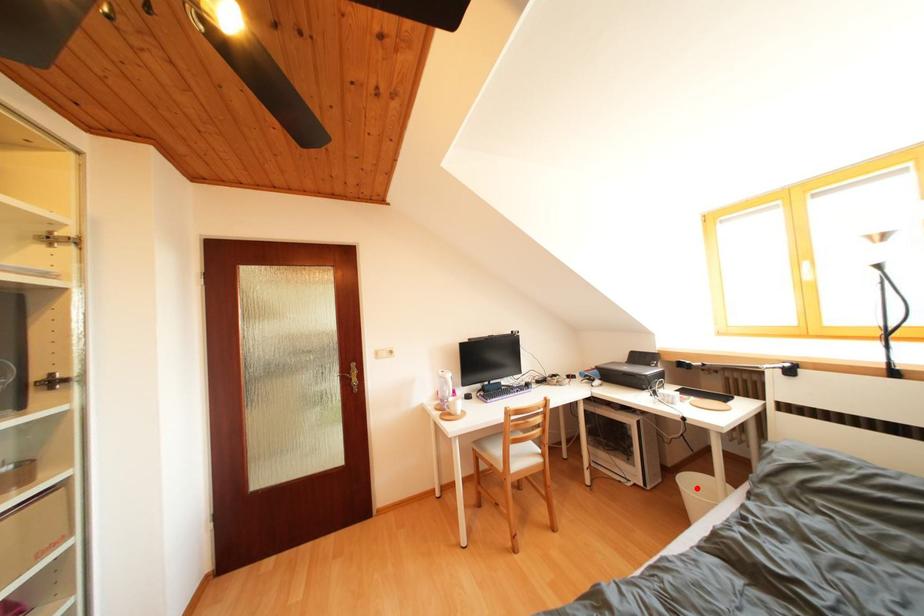
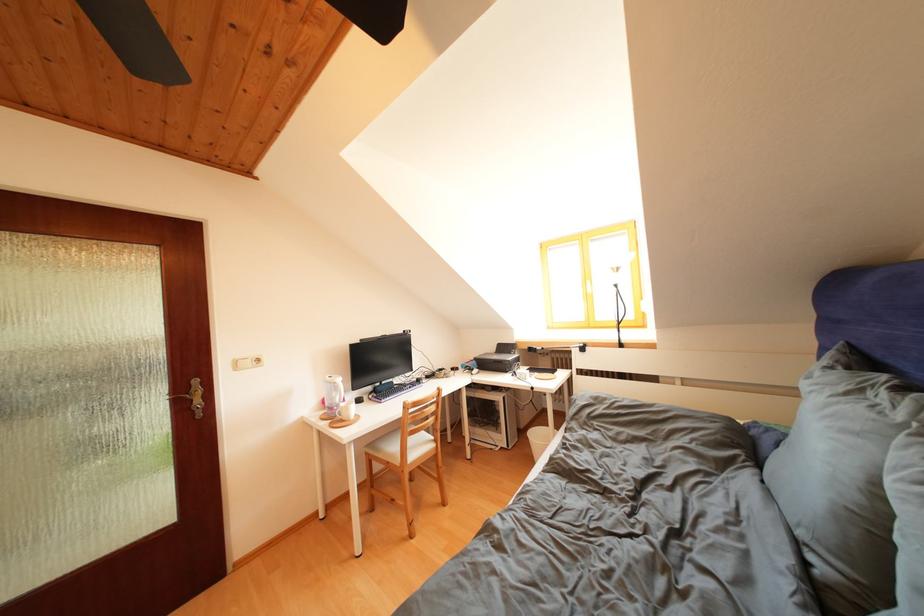
Question: A red point is marked in image1. In image2, is the corresponding 3D point closer to the camera or farther? Reply with the corresponding letter.

Choices:
 (A) The corresponding 3D point is closer.
 (B) The corresponding 3D point is farther.

Answer: (B)